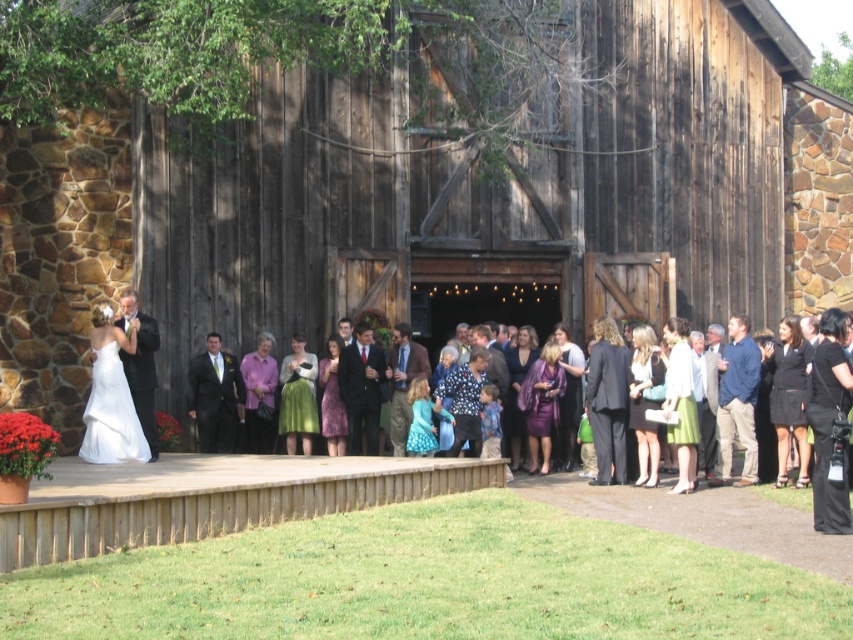
Who is shorter, matte black suit at center or matte black suit at left?

matte black suit at center

Find the location of `matte black suit at center`. matte black suit at center is located at coordinates (215, 396).

This screenshot has height=640, width=853. What do you see at coordinates (215, 396) in the screenshot? I see `matte black suit at center` at bounding box center [215, 396].

You are a GUI agent. You are given a task and a screenshot of the screen. Output one action in this format:
    pyautogui.click(x=<x>, y=<y>)
    Task: Click on the matte black suit at center
    
    Given the screenshot: What is the action you would take?
    pyautogui.click(x=215, y=396)

Does matte black suit at center have a lesser height compared to brown wool coat at center?

Yes, matte black suit at center is shorter than brown wool coat at center.

Does matte black suit at center lie behind brown wool coat at center?

Yes.

Between point (202, 432) and point (410, 362), which one is positioned behind?

The point (410, 362) is behind.

In order to click on matte black suit at center in this screenshot , I will do `click(215, 396)`.

The height and width of the screenshot is (640, 853). Describe the element at coordinates (737, 401) in the screenshot. I see `blue denim shirt at right` at that location.

Consider the image. Can you confirm if blue denim shirt at right is shorter than matte black suit at left?

No, blue denim shirt at right is not shorter than matte black suit at left.

Between point (743, 348) and point (142, 355), which one is positioned behind?

Positioned behind is point (743, 348).

This screenshot has width=853, height=640. I want to click on blue denim shirt at right, so click(737, 401).